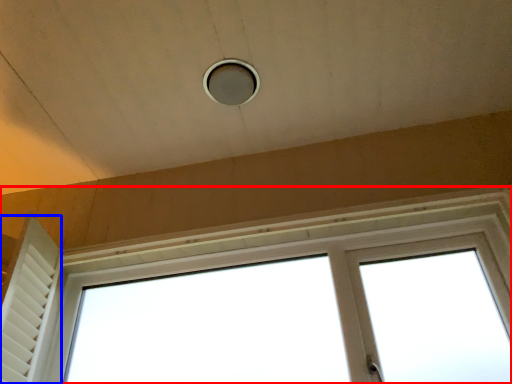
Question: Which object is closer to the camera taking this photo, window (highlighted by a red box) or shutter (highlighted by a blue box)?

Choices:
 (A) window
 (B) shutter

Answer: (A)